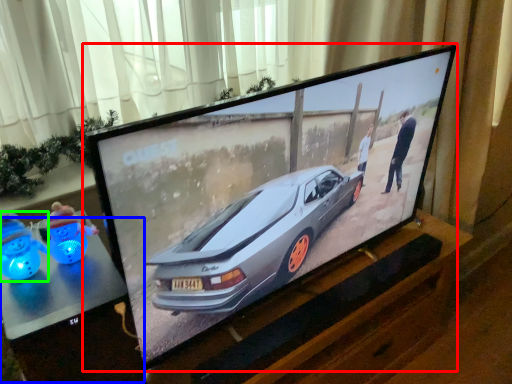
Question: Based on their relative distances, which object is nearer to television (highlighted by a red box)? Choose from table (highlighted by a blue box) and toy (highlighted by a green box).

Choices:
 (A) table
 (B) toy

Answer: (A)